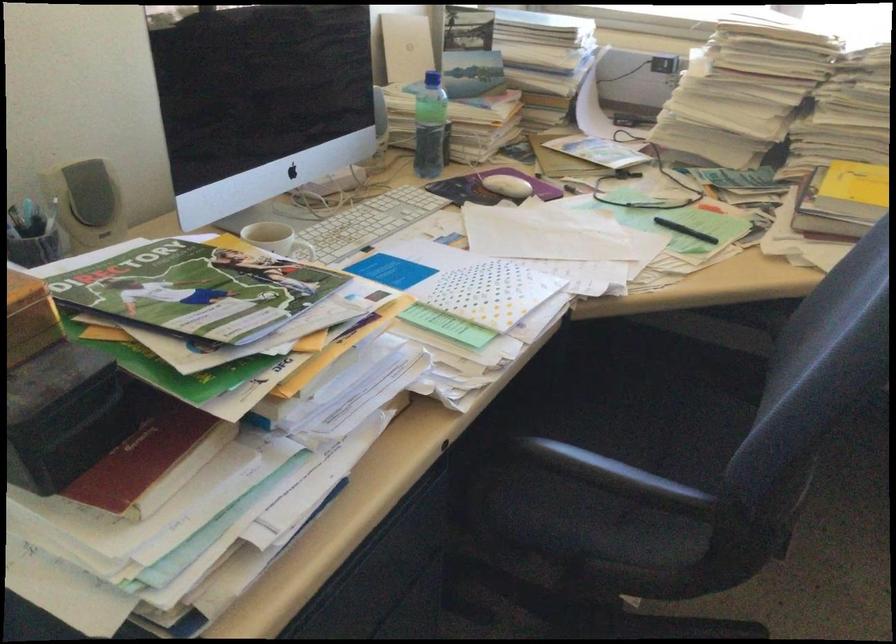
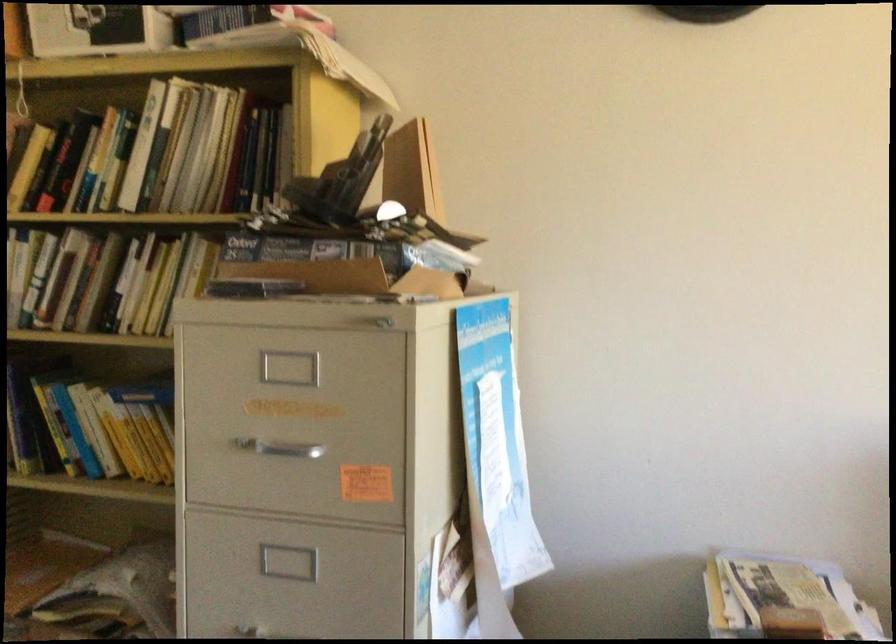
Question: The first image is from the beginning of the video and the second image is from the end. How did the camera likely rotate when shooting the video?

Choices:
 (A) Left
 (B) Right
 (C) Up
 (D) Down

Answer: (A)